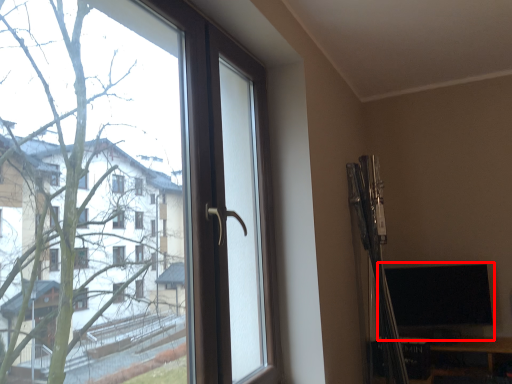
Question: Where is computer monitor (annotated by the red box) located in relation to window in the image?

Choices:
 (A) left
 (B) right

Answer: (B)